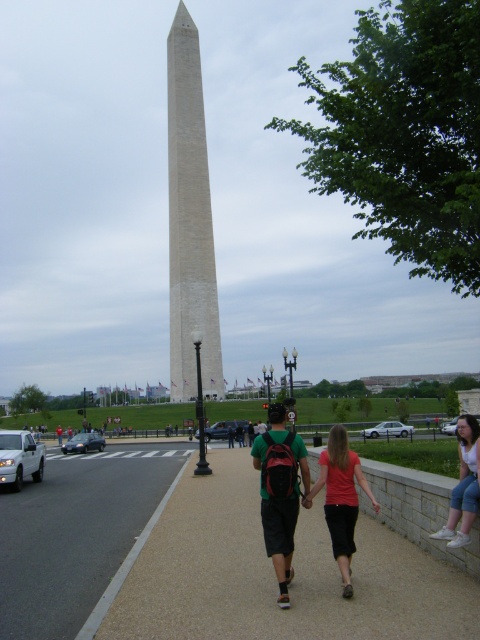
You are standing on the paved pathway where the two individuals are walking. You want to take a photo of the white stone obelisk at center and the white fabric skirt at lower right in the same frame. Which object should you position closer to the left side of your camera viewfinder to include both in the shot?

To include both the white stone obelisk at center and the white fabric skirt at lower right in the same frame, you should position the white stone obelisk at center closer to the left side of your camera viewfinder since it is already to the left of the white fabric skirt at lower right in the scene.

You are a tourist standing on the paved pathway and want to take a photo of the white stone obelisk at center without the silver metallic sedan at lower right appearing in the frame. Which direction should you move to achieve this?

The white stone obelisk at center is positioned over the silver metallic sedan at lower right, so you should move to the left or right to position yourself so that the obelisk is no longer directly above the sedan in your camera frame.

You are a photographer planning to take a wide shot of the white stone obelisk at center and the silver metallic sedan at lower right. If the sedan is parked closer to you than the obelisk, which object will appear wider in the photo?

The silver metallic sedan at lower right will appear wider in the photo because even though the white stone obelisk at center is wider in actual size, the sedan is closer to the camera, making it appear wider in the image.